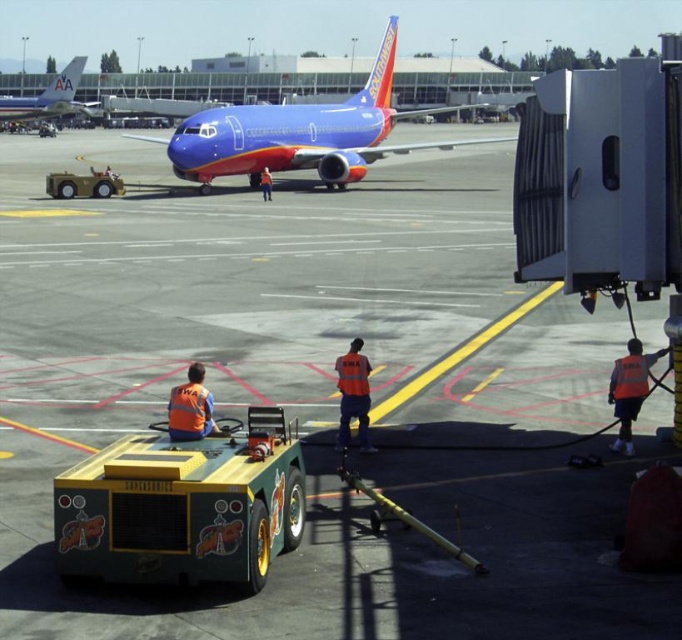
Can you confirm if blue glossy airplane at upper left is smaller than orange reflective vest at lower center?

No, blue glossy airplane at upper left is not smaller than orange reflective vest at lower center.

Is point (3, 112) farther from viewer compared to point (207, 404)?

Yes.

You are a GUI agent. You are given a task and a screenshot of the screen. Output one action in this format:
    pyautogui.click(x=<x>, y=<y>)
    Task: Click on the blue glossy airplane at upper left
    The width and height of the screenshot is (682, 640).
    Given the screenshot: What is the action you would take?
    pyautogui.click(x=48, y=97)

You are a GUI agent. You are given a task and a screenshot of the screen. Output one action in this format:
    pyautogui.click(x=<x>, y=<y>)
    Task: Click on the blue glossy airplane at upper left
    The image size is (682, 640).
    Given the screenshot: What is the action you would take?
    pyautogui.click(x=48, y=97)

Is blue glossy airplane at center bigger than orange reflective safety vest at lower right?

Indeed, blue glossy airplane at center has a larger size compared to orange reflective safety vest at lower right.

Does point (381, 150) lie behind point (636, 365)?

Yes, point (381, 150) is behind point (636, 365).

What do you see at coordinates (301, 132) in the screenshot?
I see `blue glossy airplane at center` at bounding box center [301, 132].

You are a GUI agent. You are given a task and a screenshot of the screen. Output one action in this format:
    pyautogui.click(x=<x>, y=<y>)
    Task: Click on the blue glossy airplane at center
    The width and height of the screenshot is (682, 640).
    Given the screenshot: What is the action you would take?
    pyautogui.click(x=301, y=132)

Does point (263, 109) lie in front of point (63, 108)?

Yes.

Is blue glossy airplane at center to the left of blue glossy airplane at upper left from the viewer's perspective?

In fact, blue glossy airplane at center is to the right of blue glossy airplane at upper left.

Identify the location of blue glossy airplane at center. (301, 132).

Where is `blue glossy airplane at center`? blue glossy airplane at center is located at coordinates (301, 132).